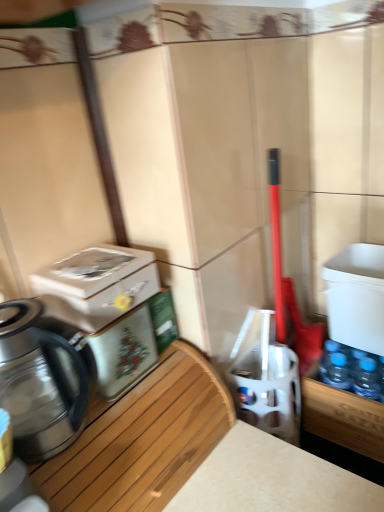
At what (x,y) coordinates should I click in order to perform the action: click on free space to the right of shiny metallic kettle at left. Please return your answer as a coordinate pair (x, y). Looking at the image, I should click on (133, 415).